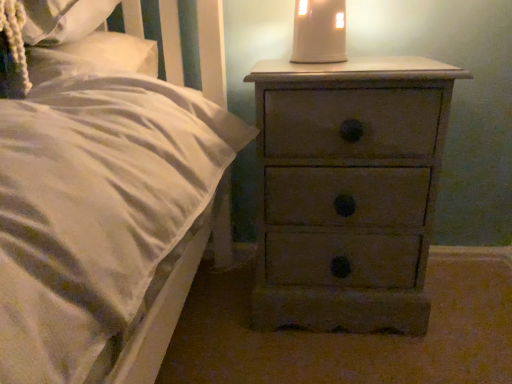
Question: Considering the relative sizes of matte beige lampshade at upper center and distressed wood chest of drawers at right in the image provided, is matte beige lampshade at upper center wider than distressed wood chest of drawers at right?

Choices:
 (A) yes
 (B) no

Answer: (B)

Question: Is matte beige lampshade at upper center beside distressed wood chest of drawers at right?

Choices:
 (A) no
 (B) yes

Answer: (A)

Question: Is the position of matte beige lampshade at upper center more distant than that of distressed wood chest of drawers at right?

Choices:
 (A) no
 (B) yes

Answer: (B)

Question: Does matte beige lampshade at upper center have a larger size compared to distressed wood chest of drawers at right?

Choices:
 (A) no
 (B) yes

Answer: (A)

Question: Considering the relative sizes of matte beige lampshade at upper center and distressed wood chest of drawers at right in the image provided, is matte beige lampshade at upper center smaller than distressed wood chest of drawers at right?

Choices:
 (A) no
 (B) yes

Answer: (B)

Question: From a real-world perspective, is matte beige lampshade at upper center on top of distressed wood chest of drawers at right?

Choices:
 (A) yes
 (B) no

Answer: (A)

Question: Is distressed wood chest of drawers at right further to camera compared to matte beige lampshade at upper center?

Choices:
 (A) no
 (B) yes

Answer: (A)

Question: Does distressed wood chest of drawers at right have a greater width compared to matte beige lampshade at upper center?

Choices:
 (A) no
 (B) yes

Answer: (B)

Question: Can you confirm if distressed wood chest of drawers at right is positioned to the left of matte beige lampshade at upper center?

Choices:
 (A) no
 (B) yes

Answer: (A)

Question: Considering the relative sizes of distressed wood chest of drawers at right and matte beige lampshade at upper center in the image provided, is distressed wood chest of drawers at right bigger than matte beige lampshade at upper center?

Choices:
 (A) no
 (B) yes

Answer: (B)

Question: Is distressed wood chest of drawers at right next to matte beige lampshade at upper center?

Choices:
 (A) yes
 (B) no

Answer: (B)

Question: Does distressed wood chest of drawers at right appear on the right side of matte beige lampshade at upper center?

Choices:
 (A) no
 (B) yes

Answer: (B)

Question: Relative to matte beige lampshade at upper center, is distressed wood chest of drawers at right in front or behind?

Choices:
 (A) behind
 (B) front

Answer: (B)